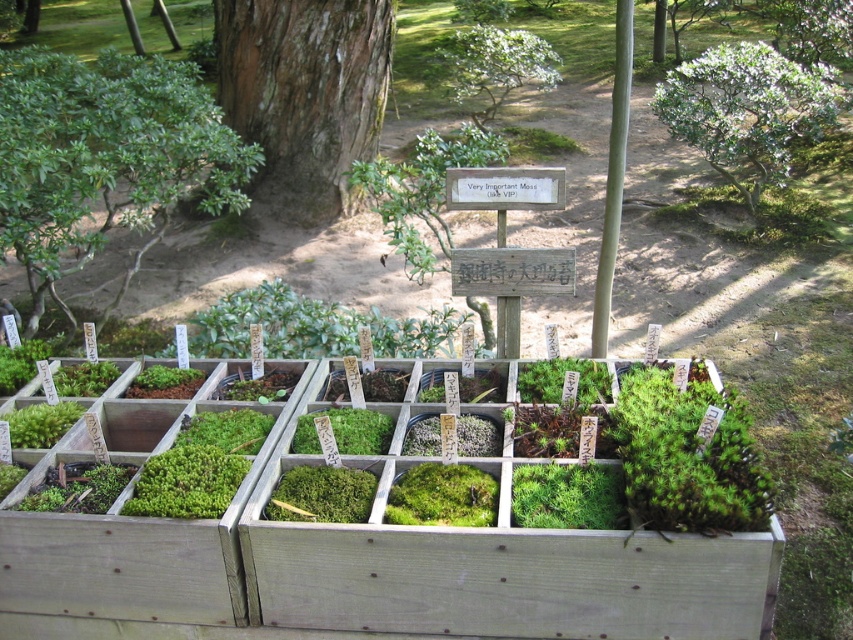
Is green leafy shrub at left wider than smooth brown bark at center?

Indeed, green leafy shrub at left has a greater width compared to smooth brown bark at center.

Between point (144, 109) and point (281, 77), which one is positioned behind?

The point (281, 77) is more distant.

The width and height of the screenshot is (853, 640). Identify the location of green leafy shrub at left. (105, 157).

Who is more distant from viewer, (271,60) or (524,38)?

The point (524,38) is more distant.

You are a GUI agent. You are given a task and a screenshot of the screen. Output one action in this format:
    pyautogui.click(x=<x>, y=<y>)
    Task: Click on the smooth brown bark at center
    This screenshot has height=640, width=853.
    Given the screenshot: What is the action you would take?
    pyautogui.click(x=305, y=93)

Who is more distant from viewer, (276, 20) or (496, 28)?

Positioned behind is point (496, 28).

Locate an element on the screen. This screenshot has height=640, width=853. smooth brown bark at center is located at coordinates (305, 93).

Measure the distance between smooth brown bark at center and camera.

smooth brown bark at center is 4.08 meters away from camera.

Can you confirm if smooth brown bark at center is positioned to the right of green leafy shrub at upper right?

In fact, smooth brown bark at center is to the left of green leafy shrub at upper right.

What do you see at coordinates (305, 93) in the screenshot?
I see `smooth brown bark at center` at bounding box center [305, 93].

Where is `smooth brown bark at center`? The image size is (853, 640). smooth brown bark at center is located at coordinates (305, 93).